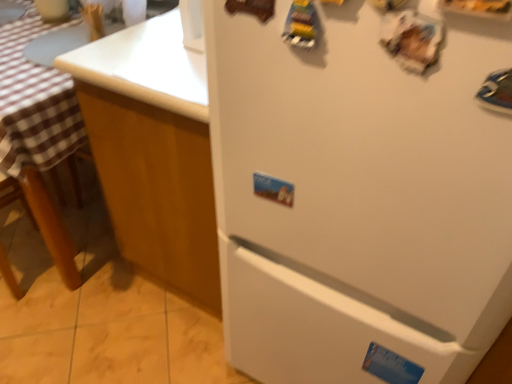
In the scene shown: Measure the distance between point (492, 188) and camera.

The depth of point (492, 188) is 21.54 inches.

What are the coordinates of `white matte refrigerator at center` in the screenshot? It's located at [x=359, y=198].

What do you see at coordinates (359, 198) in the screenshot? I see `white matte refrigerator at center` at bounding box center [359, 198].

Measure the distance between white matte refrigerator at center and camera.

The depth of white matte refrigerator at center is 17.35 inches.

What are the coordinates of `white matte refrigerator at center` in the screenshot? It's located at (359, 198).